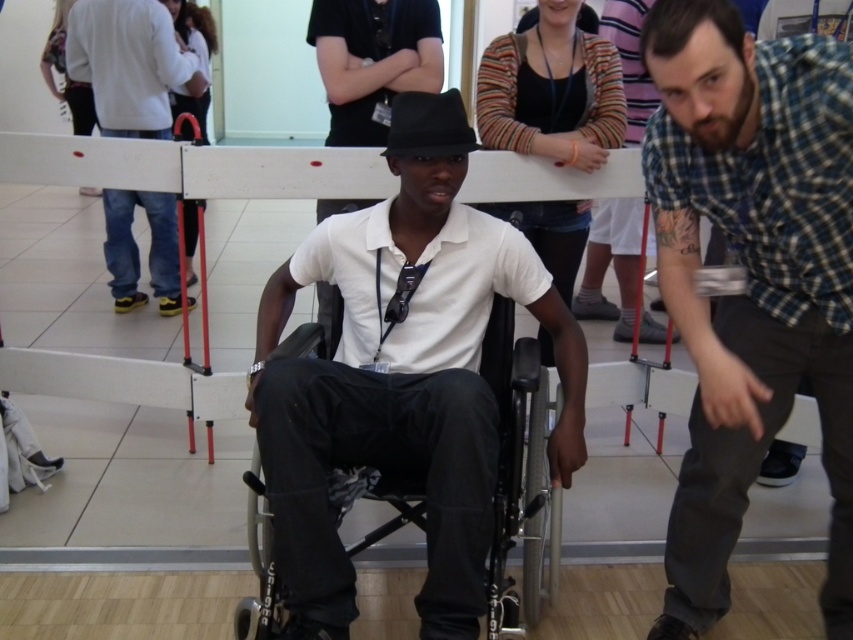
Does checkered fabric shirt at right have a lesser height compared to jeans at left?

In fact, checkered fabric shirt at right may be taller than jeans at left.

Can you confirm if checkered fabric shirt at right is thinner than jeans at left?

Yes.

Between point (675, 29) and point (167, 200), which one is positioned in front?

Point (675, 29) is more forward.

At what (x,y) coordinates should I click in order to perform the action: click on checkered fabric shirt at right. Please return your answer as a coordinate pair (x, y). The image size is (853, 640). Looking at the image, I should click on (751, 278).

Can you confirm if black plastic wheelchair at center is shorter than jeans at left?

No, black plastic wheelchair at center is not shorter than jeans at left.

Can you confirm if black plastic wheelchair at center is bigger than jeans at left?

No, black plastic wheelchair at center is not bigger than jeans at left.

Which is in front, point (260, 593) or point (119, 113)?

Positioned in front is point (260, 593).

Where is `black plastic wheelchair at center`? The height and width of the screenshot is (640, 853). black plastic wheelchair at center is located at coordinates (505, 451).

Which is behind, point (704, 40) or point (276, 516)?

The point (276, 516) is more distant.

Between checkered fabric shirt at right and black plastic wheelchair at center, which one appears on the left side from the viewer's perspective?

From the viewer's perspective, black plastic wheelchair at center appears more on the left side.

Which is in front, point (819, 195) or point (357, 612)?

Point (819, 195)

The image size is (853, 640). In order to click on checkered fabric shirt at right in this screenshot , I will do `click(751, 278)`.